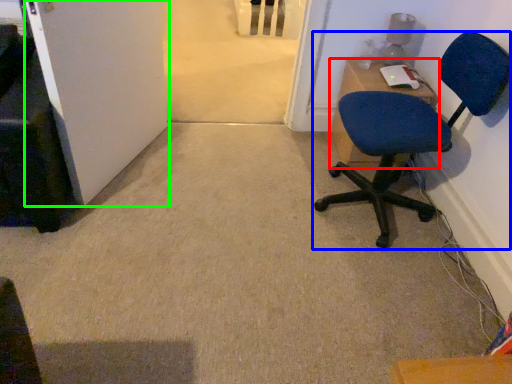
Question: Which object is the farthest from desk (highlighted by a red box)? Choose among these: chair (highlighted by a blue box) or door (highlighted by a green box).

Choices:
 (A) chair
 (B) door

Answer: (B)